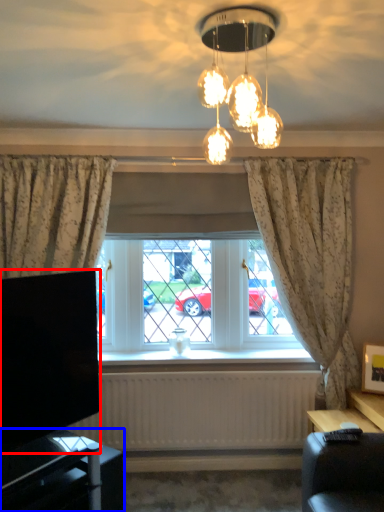
Question: Which of the following is the closest to the observer, television (highlighted by a red box) or furniture (highlighted by a blue box)?

Choices:
 (A) television
 (B) furniture

Answer: (B)